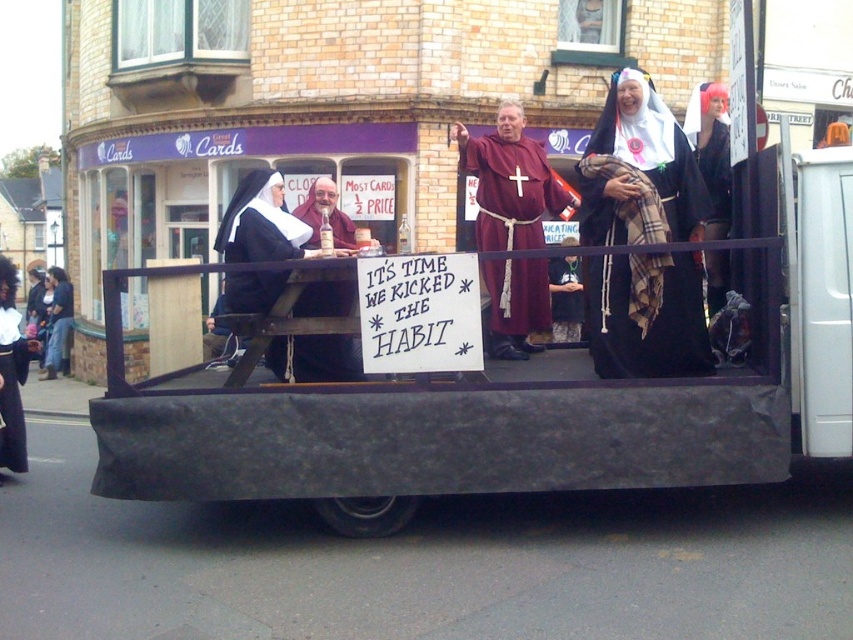
Question: Can you confirm if matte brown wooden table at center is positioned to the left of black velvet robe at left?

Choices:
 (A) yes
 (B) no

Answer: (B)

Question: Which of the following is the farthest from the observer?

Choices:
 (A) (341, 211)
 (B) (511, 186)

Answer: (A)

Question: Can you confirm if maroon fabric cross at center is smaller than black velvet robe at left?

Choices:
 (A) yes
 (B) no

Answer: (A)

Question: Can you confirm if maroon fabric cross at center is positioned below black velvet robe at left?

Choices:
 (A) yes
 (B) no

Answer: (B)

Question: Which point is farther to the camera?

Choices:
 (A) plaid woolen shawl at upper right
 (B) matte brown wooden table at center
 (C) black velvet robe at left
 (D) maroon fabric cross at center

Answer: (C)

Question: Which object is positioned farthest from the black velvet robe at left?

Choices:
 (A) maroon fabric cross at center
 (B) matte brown wooden table at center

Answer: (A)